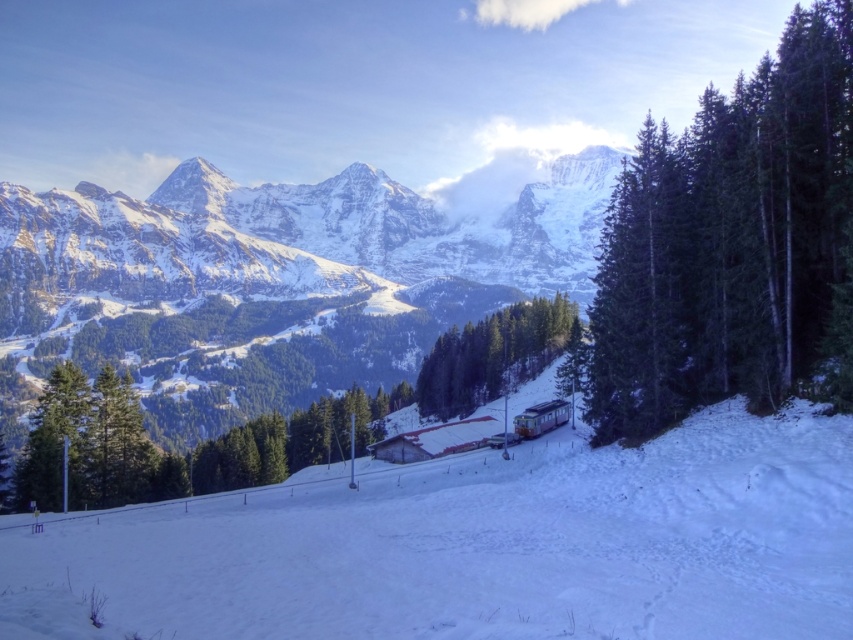
Question: From the image, what is the correct spatial relationship of green matte tree at right in relation to snowy granite mountain range at upper center?

Choices:
 (A) below
 (B) above

Answer: (A)

Question: Which point is farther to the camera?

Choices:
 (A) (721, 257)
 (B) (613, 163)
 (C) (370, 497)

Answer: (B)

Question: Is white snow ski slope at center wider than green matte tree at center?

Choices:
 (A) yes
 (B) no

Answer: (A)

Question: Is white snow ski slope at center closer to camera compared to green matte tree at center?

Choices:
 (A) no
 (B) yes

Answer: (B)

Question: Which of the following is the farthest from the observer?

Choices:
 (A) (279, 636)
 (B) (399, 225)

Answer: (B)

Question: Which point appears closest to the camera in this image?

Choices:
 (A) (450, 392)
 (B) (819, 326)
 (C) (167, 198)

Answer: (B)